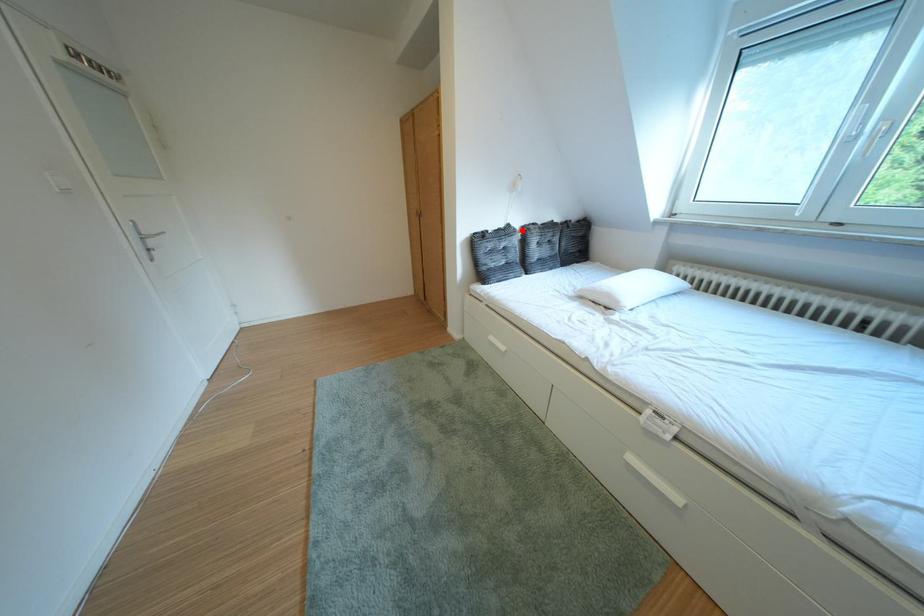
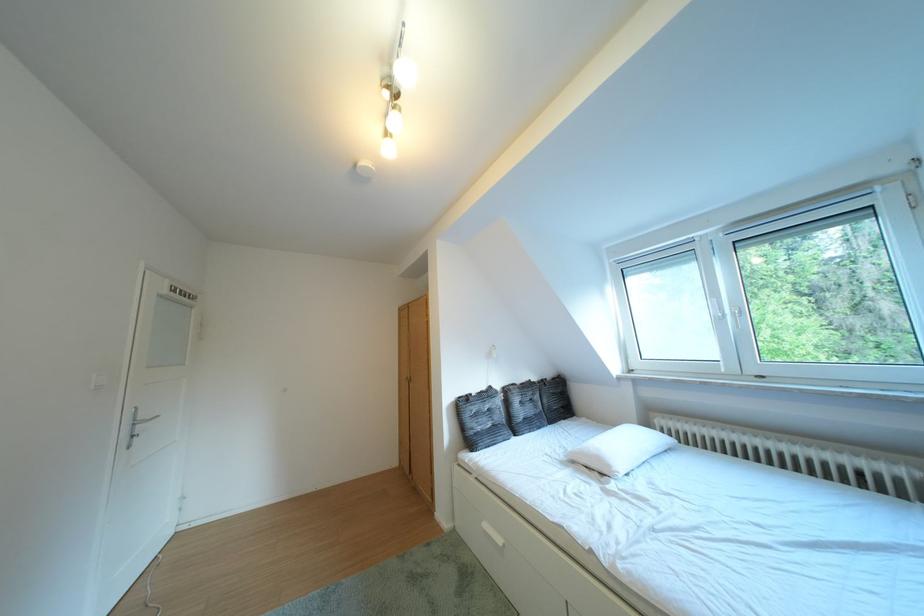
Question: I am providing you with two images of the same scene from different viewpoints. A red point is marked on the first image. At the location where the point appears in image 1, is it still visible in image 2?

Choices:
 (A) Yes
 (B) No

Answer: (A)